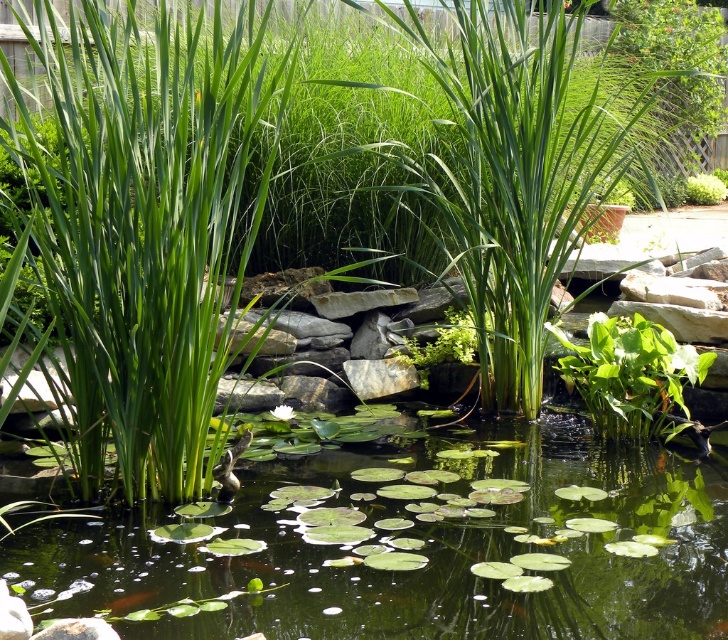
Between point (186, 577) and point (628, 368), which one is positioned behind?

The point (628, 368) is more distant.

Can you confirm if green leafy water lilies at center is bigger than green leafy plant at center?

Yes.

Locate an element on the screen. green leafy water lilies at center is located at coordinates (411, 548).